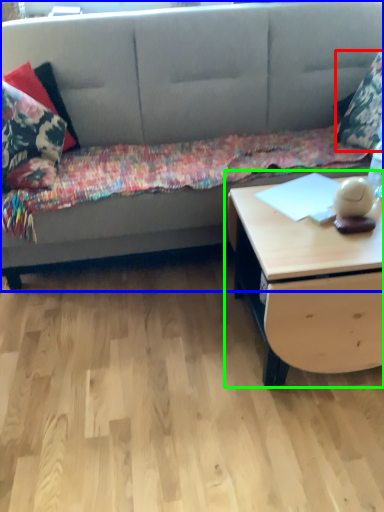
Question: Based on their relative distances, which object is nearer to pillow (highlighted by a red box)? Choose from studio couch (highlighted by a blue box) and table (highlighted by a green box).

Choices:
 (A) studio couch
 (B) table

Answer: (A)